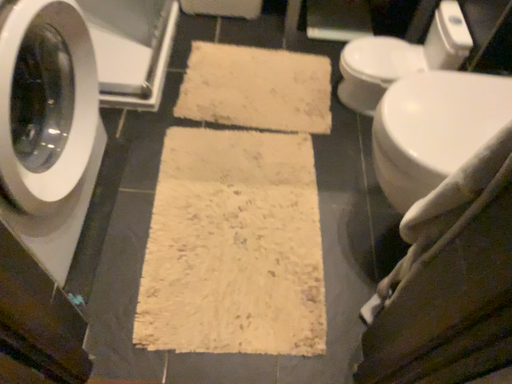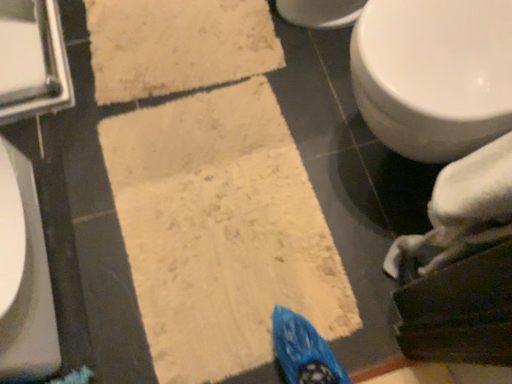
Question: Which way did the camera rotate in the video?

Choices:
 (A) rotated upward
 (B) rotated downward

Answer: (B)